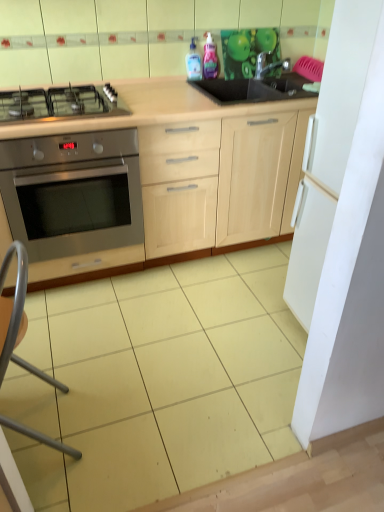
Question: Does metallic silver folding chair at lower left have a greater height compared to transparent plastic bottle at upper center, which ranks as the second bottle in right-to-left order?

Choices:
 (A) no
 (B) yes

Answer: (B)

Question: Does metallic silver folding chair at lower left appear on the right side of transparent plastic bottle at upper center, the 1th bottle positioned from the left?

Choices:
 (A) no
 (B) yes

Answer: (A)

Question: Does metallic silver folding chair at lower left lie in front of transparent plastic bottle at upper center, which ranks as the second bottle in right-to-left order?

Choices:
 (A) no
 (B) yes

Answer: (B)

Question: Are metallic silver folding chair at lower left and transparent plastic bottle at upper center, which ranks as the second bottle in right-to-left order, beside each other?

Choices:
 (A) yes
 (B) no

Answer: (B)

Question: Is transparent plastic bottle at upper center, the 1th bottle positioned from the left, at the back of metallic silver folding chair at lower left?

Choices:
 (A) yes
 (B) no

Answer: (B)

Question: Considering the relative sizes of metallic silver folding chair at lower left and transparent plastic bottle at upper center, which ranks as the second bottle in right-to-left order, in the image provided, is metallic silver folding chair at lower left thinner than transparent plastic bottle at upper center, which ranks as the second bottle in right-to-left order,?

Choices:
 (A) no
 (B) yes

Answer: (A)

Question: Are satin silver gas stove at left and metallic faucet at upper right making contact?

Choices:
 (A) yes
 (B) no

Answer: (B)

Question: Are satin silver gas stove at left and metallic faucet at upper right far apart?

Choices:
 (A) no
 (B) yes

Answer: (B)

Question: Is satin silver gas stove at left oriented towards metallic faucet at upper right?

Choices:
 (A) no
 (B) yes

Answer: (A)

Question: Is satin silver gas stove at left at the left side of metallic faucet at upper right?

Choices:
 (A) no
 (B) yes

Answer: (B)

Question: From a real-world perspective, is satin silver gas stove at left on metallic faucet at upper right?

Choices:
 (A) yes
 (B) no

Answer: (B)

Question: Can you confirm if satin silver gas stove at left is bigger than metallic faucet at upper right?

Choices:
 (A) yes
 (B) no

Answer: (A)

Question: Is stainless steel oven at left a part of light wood cabinet at center?

Choices:
 (A) no
 (B) yes

Answer: (B)